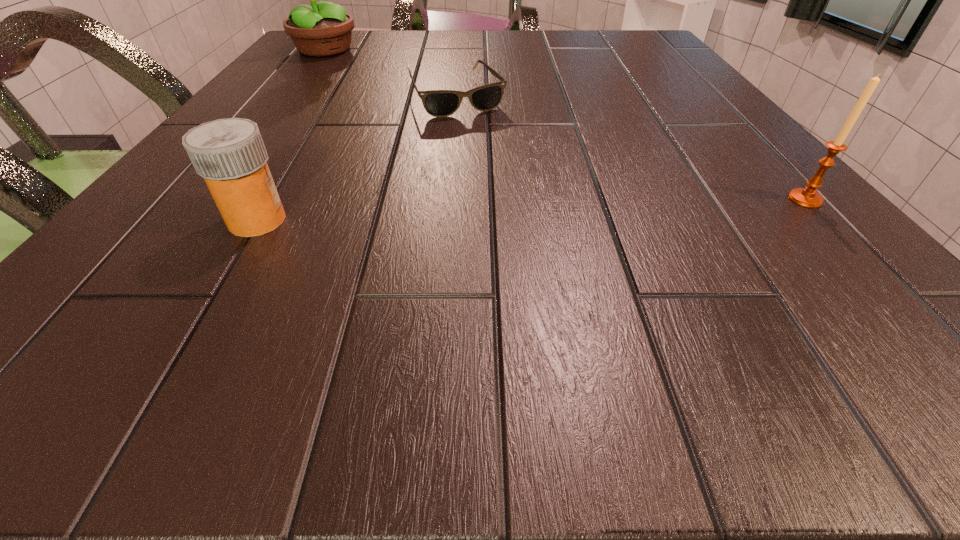
What are the coordinates of `object positioned at the far left corner` in the screenshot? It's located at (323, 29).

What are the coordinates of `object situated at the near left corner` in the screenshot? It's located at (230, 155).

Identify the location of free space at the far edge. This screenshot has width=960, height=540. point(557,35).

Where is `vacant space at the near edge of the desktop`? The width and height of the screenshot is (960, 540). vacant space at the near edge of the desktop is located at coordinates (427, 282).

This screenshot has width=960, height=540. In order to click on vacant space at the left edge of the desktop in this screenshot , I will do `click(277, 141)`.

The height and width of the screenshot is (540, 960). Find the location of `free spot at the right edge of the desktop`. free spot at the right edge of the desktop is located at coordinates (713, 134).

Find the location of a particular element. vacant space at the far left corner of the desktop is located at coordinates (362, 35).

Identify the location of free space at the near right corner of the desktop. 760,240.

Identify the location of free space between the medicine and the candle_holder. The image size is (960, 540). (531, 210).

This screenshot has height=540, width=960. Find the location of `vacant region between the tallest object and the medicine`. vacant region between the tallest object and the medicine is located at coordinates (291, 135).